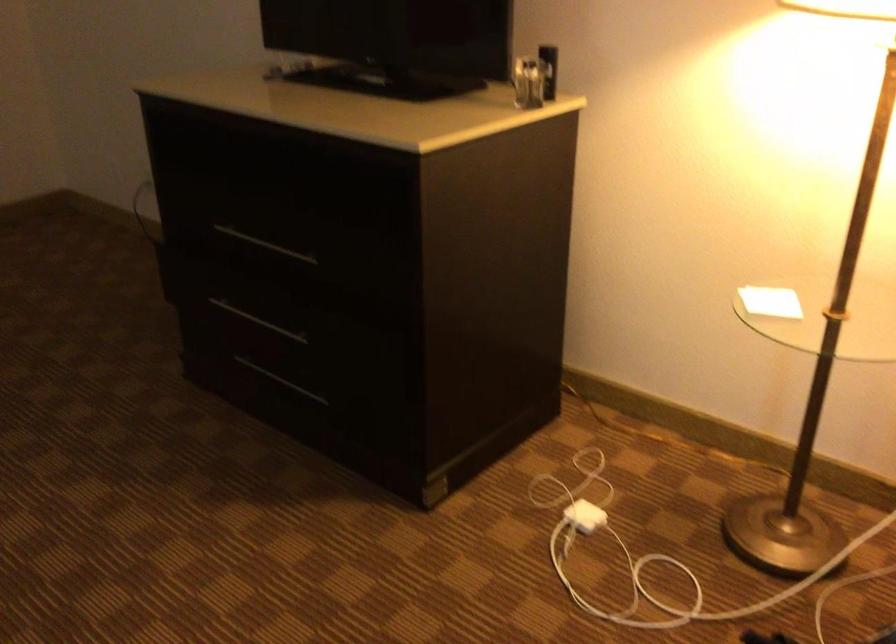
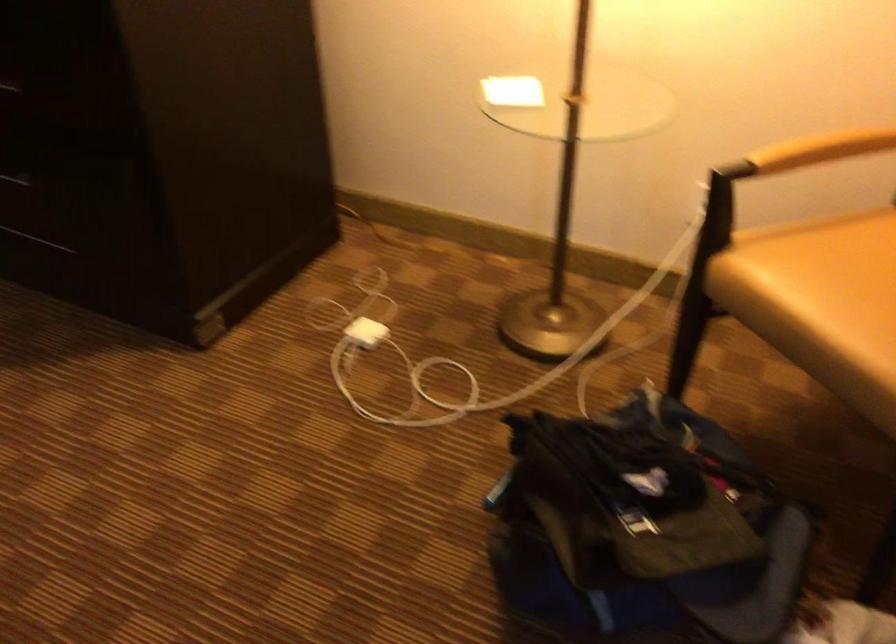
In the second image, find the point that corresponds to (x=588, y=513) in the first image.

(366, 332)